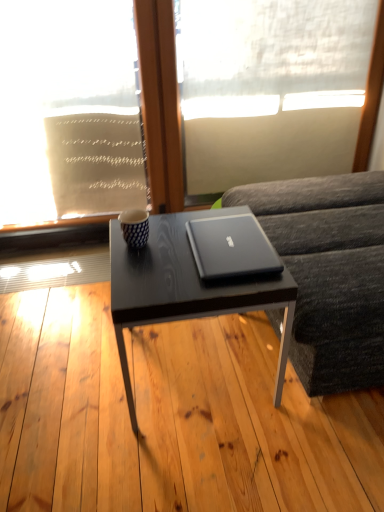
Where is `unoccupied region to the right of blue and white textured mug at center`? unoccupied region to the right of blue and white textured mug at center is located at coordinates (172, 234).